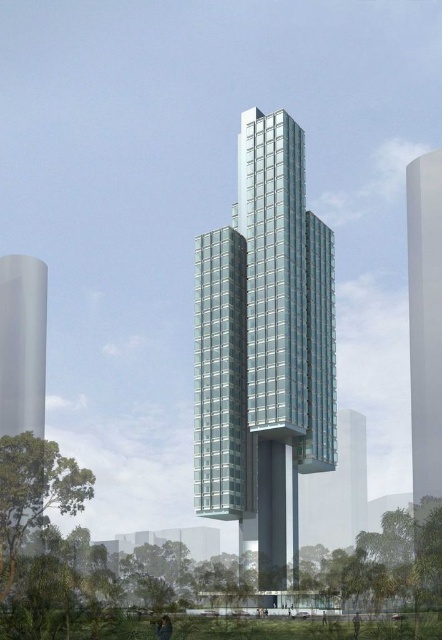
Does white glossy tower at right have a greater height compared to transparent glass tower at left?

Yes.

Who is higher up, white glossy tower at right or transparent glass tower at left?

white glossy tower at right is higher up.

Which is behind, point (408, 321) or point (10, 358)?

The point (408, 321) is behind.

Image resolution: width=442 pixels, height=640 pixels. Identify the location of white glossy tower at right. click(425, 333).

What do you see at coordinates (265, 348) in the screenshot? The image size is (442, 640). I see `clear glass tower at center` at bounding box center [265, 348].

Who is higher up, clear glass tower at center or white glossy tower at right?

clear glass tower at center is higher up.

Between point (255, 124) and point (433, 262), which one is positioned in front?

Positioned in front is point (255, 124).

Find the location of `clear glass tower at center`. clear glass tower at center is located at coordinates (265, 348).

In the scene shown: Between clear glass tower at center and transparent glass tower at left, which one appears on the right side from the viewer's perspective?

From the viewer's perspective, clear glass tower at center appears more on the right side.

Between point (233, 211) and point (18, 291), which one is positioned behind?

Positioned behind is point (18, 291).

Locate an element on the screen. clear glass tower at center is located at coordinates 265,348.